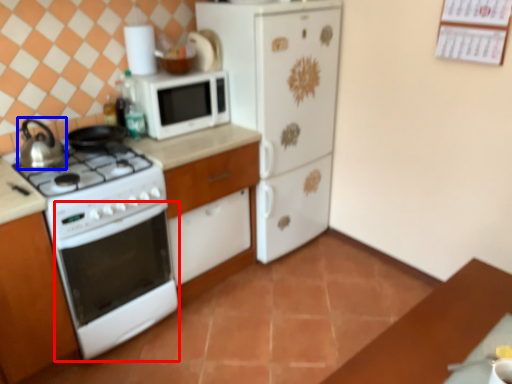
Question: Which of the following is the closest to the observer, oven (highlighted by a red box) or kitchen appliance (highlighted by a blue box)?

Choices:
 (A) oven
 (B) kitchen appliance

Answer: (A)